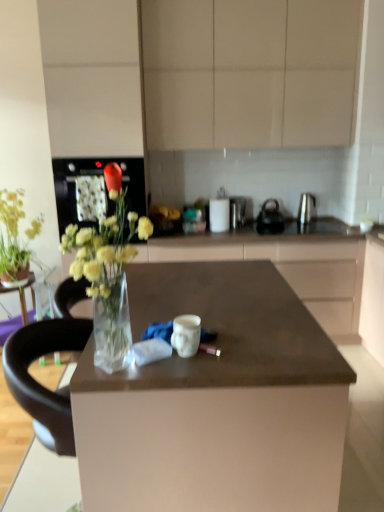
What do you see at coordinates (219, 212) in the screenshot?
I see `white paper towel at center, the fourth appliance viewed from the right` at bounding box center [219, 212].

Measure the distance between satin silver toaster at center, which is the third appliance in right-to-left order, and camera.

The depth of satin silver toaster at center, which is the third appliance in right-to-left order, is 3.12 meters.

Describe the element at coordinates (306, 208) in the screenshot. The width and height of the screenshot is (384, 512). I see `satin silver kettle at right, positioned as the fourth appliance in left-to-right order` at that location.

Locate an element on the screen. The image size is (384, 512). brown matte counter at center is located at coordinates (291, 265).

Identify the location of matte beige cabinets at upper center. (249, 72).

The image size is (384, 512). Find the location of `white paper towel at center, arranged as the 1th appliance when viewed from the left`. white paper towel at center, arranged as the 1th appliance when viewed from the left is located at coordinates (219, 212).

Is green matte plant at upper left, which ranks as the first flower in left-to-right order, positioned beyond the bounds of white paper towel at center, arranged as the 1th appliance when viewed from the left?

Yes, green matte plant at upper left, which ranks as the first flower in left-to-right order, is located beyond the bounds of white paper towel at center, arranged as the 1th appliance when viewed from the left.

Where is `flower below the white paper towel at center, the fourth appliance viewed from the right (from a real-world perspective)`? The width and height of the screenshot is (384, 512). flower below the white paper towel at center, the fourth appliance viewed from the right (from a real-world perspective) is located at coordinates (13, 240).

Is green matte plant at upper left, the 2th flower positioned from the front, oriented towards white paper towel at center, the fourth appliance viewed from the right?

No.

Can you confirm if matte brown countertop at center is positioned to the right of matte red rose at center, arranged as the second flower when viewed from the back?

Yes.

Does point (272, 370) come farther from viewer compared to point (120, 185)?

No, (272, 370) is in front of (120, 185).

Is matte brown countertop at center in contact with matte red rose at center, which is the second flower from left to right?

No, matte brown countertop at center is not making contact with matte red rose at center, which is the second flower from left to right.

From the image's perspective, is matte brown countertop at center below matte red rose at center, arranged as the second flower when viewed from the back?

Yes, from the image's perspective, matte brown countertop at center is below matte red rose at center, arranged as the second flower when viewed from the back.

How different are the orientations of matte red rose at center, which is the second flower from left to right, and green matte plant at upper left, which ranks as the 2th flower in right-to-left order, in degrees?

matte red rose at center, which is the second flower from left to right, and green matte plant at upper left, which ranks as the 2th flower in right-to-left order, are facing 0.476 degrees away from each other.

Is matte red rose at center, which is the second flower from left to right, not within green matte plant at upper left, which ranks as the 2th flower in right-to-left order?

Yes, matte red rose at center, which is the second flower from left to right, is not within green matte plant at upper left, which ranks as the 2th flower in right-to-left order.

Considering the sizes of matte red rose at center, which is the first flower from right to left, and green matte plant at upper left, which ranks as the first flower in left-to-right order, in the image, is matte red rose at center, which is the first flower from right to left, bigger or smaller than green matte plant at upper left, which ranks as the first flower in left-to-right order,?

matte red rose at center, which is the first flower from right to left, is smaller than green matte plant at upper left, which ranks as the first flower in left-to-right order.

Is matte red rose at center, which ranks as the 1th flower in front-to-back order, wider or thinner than green matte plant at upper left, the 2th flower positioned from the front?

In the image, matte red rose at center, which ranks as the 1th flower in front-to-back order, appears to be more narrow than green matte plant at upper left, the 2th flower positioned from the front.

From the picture: Do you think polished stainless steel kettle at center, acting as the 2th appliance starting from the right, is within white paper towel at center, the fourth appliance viewed from the right, or outside of it?

polished stainless steel kettle at center, acting as the 2th appliance starting from the right, cannot be found inside white paper towel at center, the fourth appliance viewed from the right.

Is polished stainless steel kettle at center, acting as the 2th appliance starting from the right, smaller than white paper towel at center, the fourth appliance viewed from the right?

Actually, polished stainless steel kettle at center, acting as the 2th appliance starting from the right, might be larger than white paper towel at center, the fourth appliance viewed from the right.

Can you confirm if polished stainless steel kettle at center, which ranks as the 3th appliance in left-to-right order, is positioned to the right of white paper towel at center, the fourth appliance viewed from the right?

Yes, polished stainless steel kettle at center, which ranks as the 3th appliance in left-to-right order, is to the right of white paper towel at center, the fourth appliance viewed from the right.

From a real-world perspective, relative to white paper towel at center, arranged as the 1th appliance when viewed from the left, is polished stainless steel kettle at center, acting as the 2th appliance starting from the right, vertically above or below?

polished stainless steel kettle at center, acting as the 2th appliance starting from the right, is below white paper towel at center, arranged as the 1th appliance when viewed from the left.

Consider the image. From a real-world perspective, is satin silver kettle at right, the 1th appliance in the right-to-left sequence, physically above green matte plant at upper left, which ranks as the 2th flower in right-to-left order?

Yes, from a real-world perspective, satin silver kettle at right, the 1th appliance in the right-to-left sequence, is on top of green matte plant at upper left, which ranks as the 2th flower in right-to-left order.

Consider the image. Can you confirm if satin silver kettle at right, the 1th appliance in the right-to-left sequence, is positioned to the right of green matte plant at upper left, which ranks as the 2th flower in right-to-left order?

Yes.

How different are the orientations of satin silver kettle at right, positioned as the fourth appliance in left-to-right order, and green matte plant at upper left, which ranks as the 2th flower in right-to-left order, in degrees?

They differ by 0.476 degrees in their facing directions.

Is point (305, 194) behind point (13, 207)?

Yes, it is.

Are matte beige cabinets at upper center and satin silver kettle at right, the 1th appliance in the right-to-left sequence, making contact?

There is a gap between matte beige cabinets at upper center and satin silver kettle at right, the 1th appliance in the right-to-left sequence.

Is point (331, 86) positioned behind point (299, 222)?

No, it is not.

Is matte beige cabinets at upper center taller or shorter than satin silver kettle at right, positioned as the fourth appliance in left-to-right order?

Considering their sizes, matte beige cabinets at upper center has more height than satin silver kettle at right, positioned as the fourth appliance in left-to-right order.

Which is more to the left, brown matte counter at center or black glass oven at upper left?

Positioned to the left is black glass oven at upper left.

Can you confirm if brown matte counter at center is shorter than black glass oven at upper left?

Incorrect, the height of brown matte counter at center does not fall short of that of black glass oven at upper left.

Is brown matte counter at center in front of black glass oven at upper left?

No, it is behind black glass oven at upper left.

From a real-world perspective, starting from the green matte plant at upper left, which ranks as the 2th flower in right-to-left order, which appliance is the 4th one vertically above it? Please provide its 2D coordinates.

[(219, 212)]

I want to click on countertop on the right side of matte red rose at center, which ranks as the 1th flower in front-to-back order, so click(x=223, y=331).

When comparing their distances from satin silver toaster at center, the second appliance positioned from the left, does satin silver kettle at right, the 1th appliance in the right-to-left sequence, or green matte plant at upper left, the 2th flower positioned from the front, seem closer?

satin silver kettle at right, the 1th appliance in the right-to-left sequence.

When comparing their distances from polished stainless steel kettle at center, which ranks as the 3th appliance in left-to-right order, does black glass oven at upper left or satin silver kettle at right, positioned as the fourth appliance in left-to-right order, seem further?

black glass oven at upper left lies further to polished stainless steel kettle at center, which ranks as the 3th appliance in left-to-right order, than the other object.

Looking at the image, which one is located closer to satin silver kettle at right, positioned as the fourth appliance in left-to-right order, green matte plant at upper left, which ranks as the first flower in left-to-right order, or polished stainless steel kettle at center, which ranks as the 3th appliance in left-to-right order?

polished stainless steel kettle at center, which ranks as the 3th appliance in left-to-right order, is positioned closer to the anchor satin silver kettle at right, positioned as the fourth appliance in left-to-right order.

Based on their spatial positions, is black glass oven at upper left or green matte plant at upper left, the first flower from the back, closer to satin silver kettle at right, positioned as the fourth appliance in left-to-right order?

black glass oven at upper left.

Looking at the image, which one is located further to satin silver toaster at center, the second appliance positioned from the left, black glass oven at upper left or white paper towel at center, arranged as the 1th appliance when viewed from the left?

black glass oven at upper left is further to satin silver toaster at center, the second appliance positioned from the left.

Looking at the image, which one is located further to brown matte counter at center, matte red rose at center, which is the second flower from left to right, or green matte plant at upper left, which ranks as the first flower in left-to-right order?

Among the two, green matte plant at upper left, which ranks as the first flower in left-to-right order, is located further to brown matte counter at center.

Considering their positions, is matte beige cabinets at upper center positioned further to black glass oven at upper left than white paper towel at center, the fourth appliance viewed from the right?

matte beige cabinets at upper center is further to black glass oven at upper left.

Based on their spatial positions, is green matte plant at upper left, which ranks as the 2th flower in right-to-left order, or matte red rose at center, which ranks as the 1th flower in front-to-back order, further from matte brown countertop at center?

green matte plant at upper left, which ranks as the 2th flower in right-to-left order, is further to matte brown countertop at center.

This screenshot has width=384, height=512. Find the location of `cabinetry positioned between matte brown countertop at center and white paper towel at center, the fourth appliance viewed from the right, from near to far`. cabinetry positioned between matte brown countertop at center and white paper towel at center, the fourth appliance viewed from the right, from near to far is located at coordinates (249, 72).

You are a GUI agent. You are given a task and a screenshot of the screen. Output one action in this format:
    pyautogui.click(x=<x>, y=<y>)
    Task: Click on the appliance between white paper towel at center, the fourth appliance viewed from the right, and brown matte counter at center vertically
    Image resolution: width=384 pixels, height=512 pixels.
    Given the screenshot: What is the action you would take?
    pyautogui.click(x=237, y=212)

At what (x,y) coordinates should I click in order to perform the action: click on appliance located between green matte plant at upper left, the first flower from the back, and satin silver toaster at center, which is the third appliance in right-to-left order, in the left-right direction. Please return your answer as a coordinate pair (x, y). Looking at the image, I should click on (219, 212).

This screenshot has width=384, height=512. Identify the location of cabinetry between green matte plant at upper left, which ranks as the 2th flower in right-to-left order, and satin silver kettle at right, positioned as the fourth appliance in left-to-right order. (249, 72).